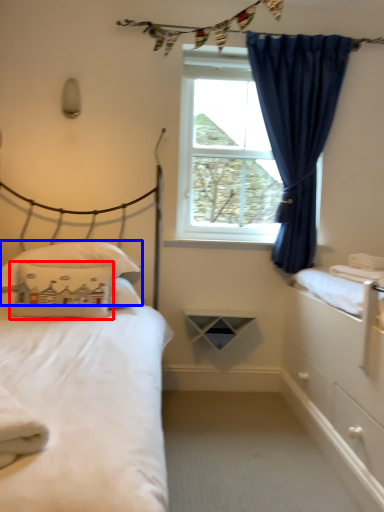
Question: Among these objects, which one is farthest to the camera, pillow (highlighted by a red box) or pillow (highlighted by a blue box)?

Choices:
 (A) pillow
 (B) pillow

Answer: (B)